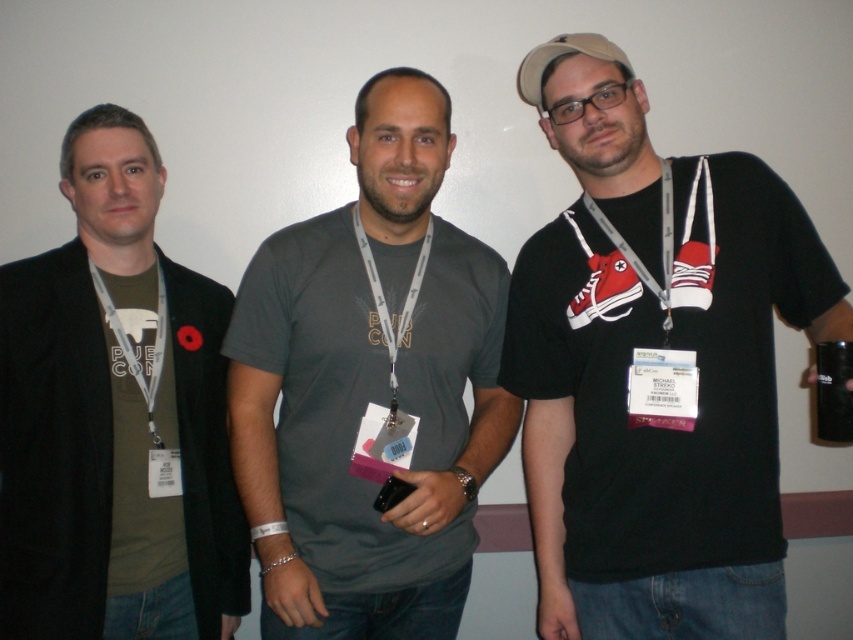
Question: Does matte gray t-shirt at center have a larger size compared to khaki fabric baseball cap at upper right?

Choices:
 (A) no
 (B) yes

Answer: (B)

Question: Based on their relative distances, which object is nearer to the matte gray shirt at center?

Choices:
 (A) khaki fabric baseball cap at upper right
 (B) black matte t-shirt at center
 (C) matte black t-shirt at center

Answer: (A)

Question: Can you confirm if black matte t-shirt at center is bigger than matte gray shirt at center?

Choices:
 (A) yes
 (B) no

Answer: (A)

Question: Which point is farther to the camera?

Choices:
 (A) green fabric at left
 (B) black matte t-shirt at center
 (C) khaki fabric baseball cap at upper right

Answer: (A)

Question: Is black matte t-shirt at center in front of green matte t-shirt at left?

Choices:
 (A) yes
 (B) no

Answer: (A)

Question: Which object appears closest to the camera in this image?

Choices:
 (A) green matte t-shirt at left
 (B) matte gray t-shirt at center
 (C) khaki fabric baseball cap at upper right
 (D) green fabric at left

Answer: (B)